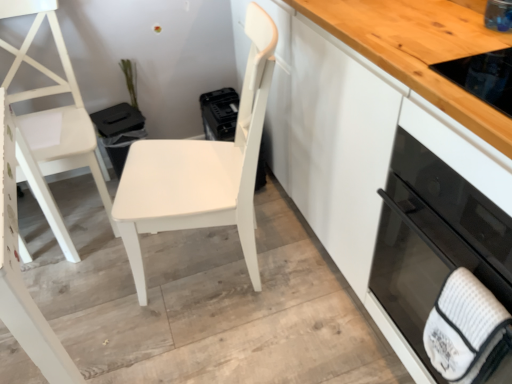
Locate an element on the screen. vacant space underneath white matte chair at left, positioned as the 1th chair in left-to-right order (from a real-world perspective) is located at coordinates (77, 210).